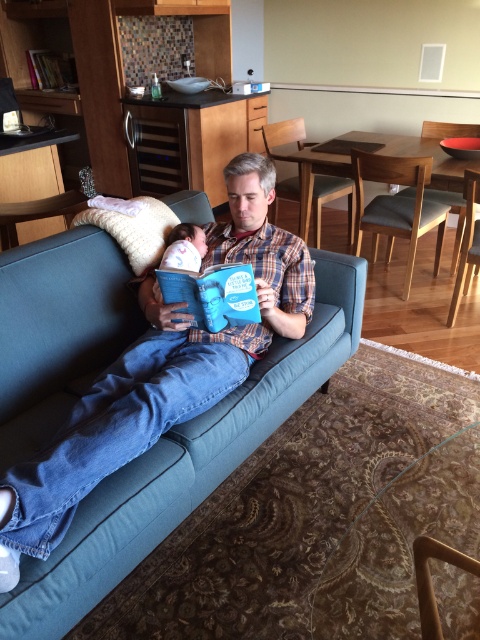
You are a delivery person who needs to place a large package on the floor near the blue fabric couch at center and the white soft baby at center. Is there enough space between them to safely place the package without disturbing the baby?

The blue fabric couch at center is located below the white soft baby at center, so placing the package between them should be possible as the couch is lower, allowing space above it for the package without disturbing the baby.

You are a delivery person who needs to place a small package between the fluffy white pillow at center and the white soft baby at center. Can you fit the package there?

The fluffy white pillow at center and white soft baby at center are 5.43 inches apart. The package is small, so it can fit between them if the package is less than 5.43 inches wide.

You are a photographer trying to capture a closeup of the white soft baby at center without moving the fluffy white pillow at center. Is the baby visible through the pillow?

The white soft baby at center is behind the fluffy white pillow at center, so the baby is not visible through the pillow.